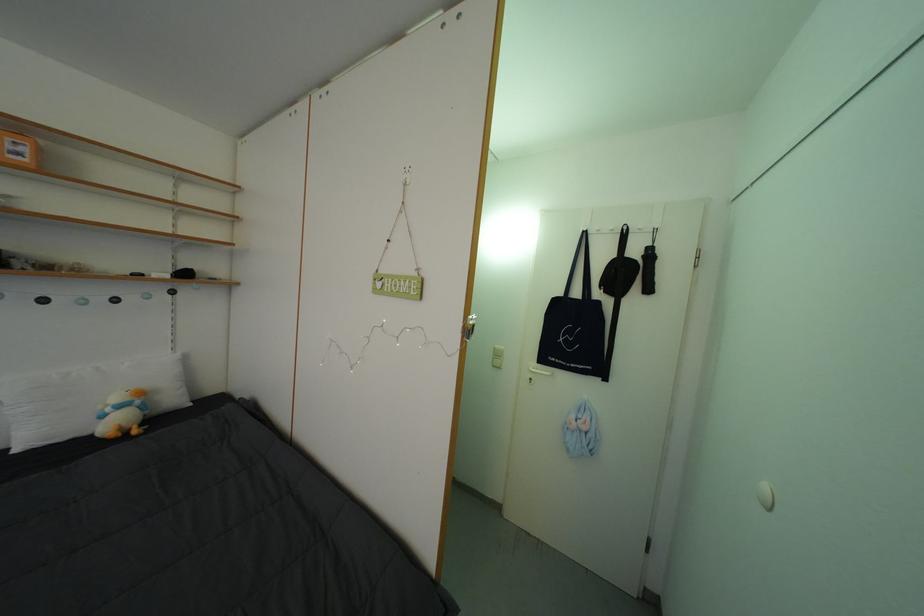
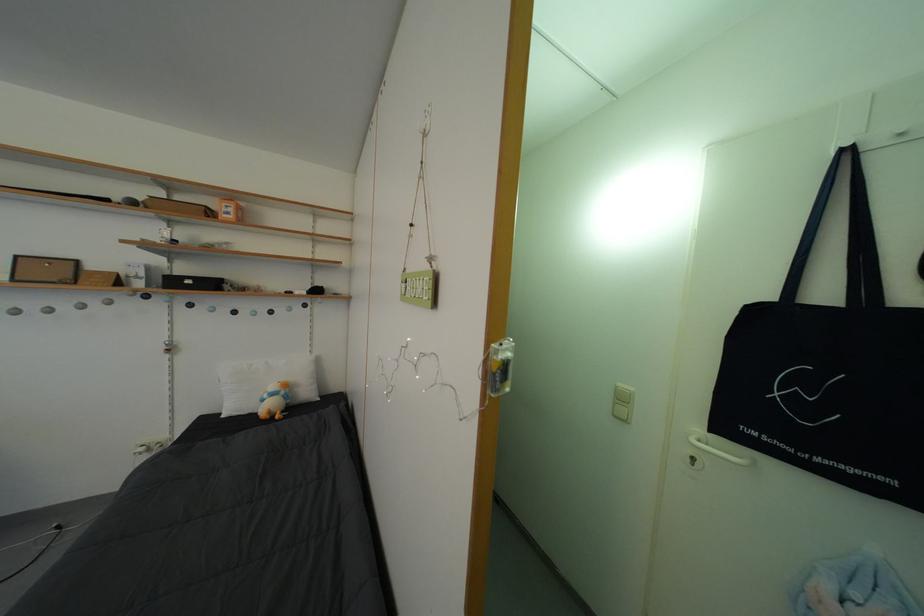
Question: How did the camera likely rotate?

Choices:
 (A) Left
 (B) Right
 (C) Up
 (D) Down

Answer: (A)